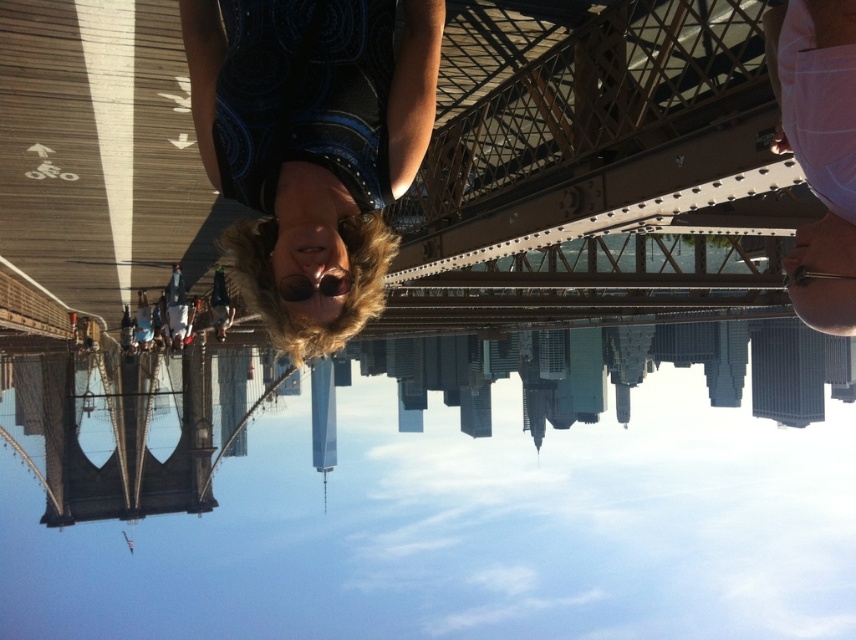
You are a photographer standing on the Brooklyn Bridge. You notice the metal bridge at center and the dark blue printed dress at center. Which object is positioned to the left when facing the bridge?

The metal bridge at center is to the left of the dark blue printed dress at center.

You are standing on the Brooklyn Bridge and looking at the scene. There is a point marked at coordinates (405, 145). According to the image, where is this point located?

The point marked at coordinates (405, 145) is located on the metal bridge at center.